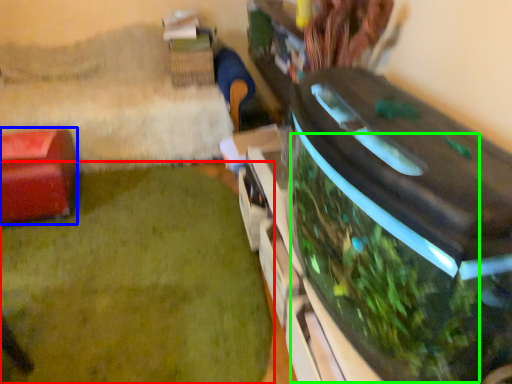
Question: Which object is positioned closest to plant (highlighted by a red box)? Select from furniture (highlighted by a blue box) and vegetation (highlighted by a green box).

Choices:
 (A) furniture
 (B) vegetation

Answer: (A)